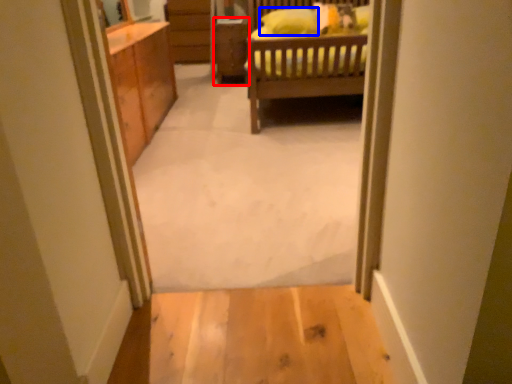
Question: Which object appears closest to the camera in this image, cabinetry (highlighted by a red box) or pillow (highlighted by a blue box)?

Choices:
 (A) cabinetry
 (B) pillow

Answer: (B)